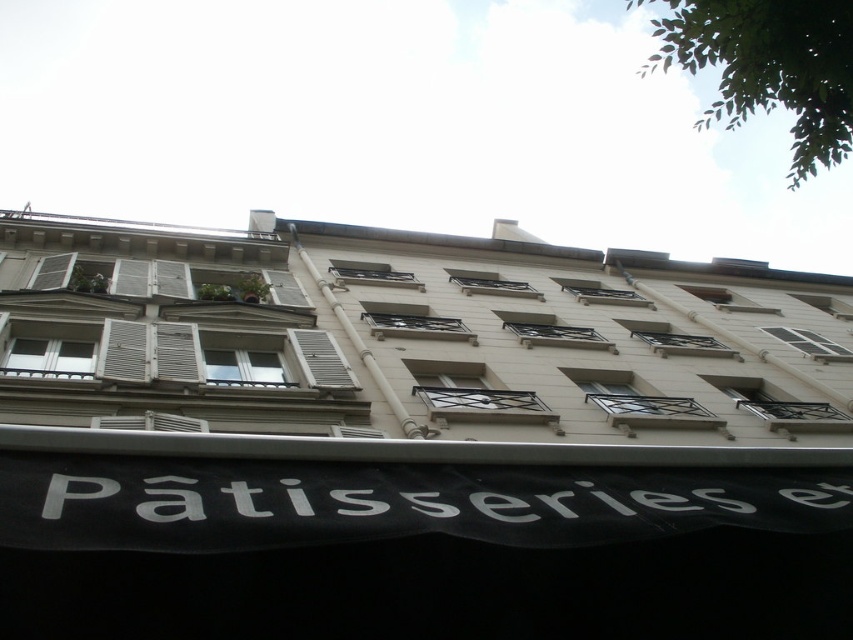
You are standing in front of the building and notice the white wooden shutters at left and the white wooden shutter at center. Which one is positioned more to the east side of the building?

The white wooden shutters at left is positioned more to the east side of the building because it is to the left of the white wooden shutter at center, and assuming the building faces north, the left side would be east.

You are standing in front of the building and want to take a photo of the sign at the bottom. If you move 10 meters closer to the building, will the point at coordinates point (309, 355) become closer to the camera than 20 meters?

The point at coordinates point (309, 355) is currently 31.17 meters away from the camera. Moving 10 meters closer would bring it to 21.17 meters away, which is still more than 20 meters. Therefore, the point will not be closer than 20 meters.